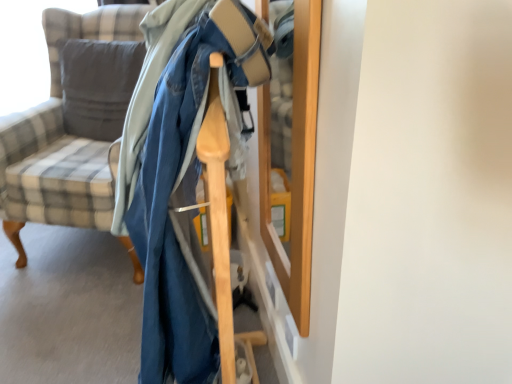
Question: Does plaid fabric chair at left have a larger size compared to soft gray cushion at left?

Choices:
 (A) no
 (B) yes

Answer: (B)

Question: Is plaid fabric chair at left closer to camera compared to soft gray cushion at left?

Choices:
 (A) yes
 (B) no

Answer: (A)

Question: Does plaid fabric chair at left have a lesser width compared to soft gray cushion at left?

Choices:
 (A) yes
 (B) no

Answer: (B)

Question: Is plaid fabric chair at left directly adjacent to soft gray cushion at left?

Choices:
 (A) yes
 (B) no

Answer: (A)

Question: Is plaid fabric chair at left oriented towards soft gray cushion at left?

Choices:
 (A) yes
 (B) no

Answer: (A)

Question: From the image's perspective, does plaid fabric chair at left appear lower than soft gray cushion at left?

Choices:
 (A) no
 (B) yes

Answer: (B)

Question: From a real-world perspective, is soft gray cushion at left on top of plaid fabric chair at left?

Choices:
 (A) no
 (B) yes

Answer: (B)

Question: Does soft gray cushion at left have a smaller size compared to plaid fabric chair at left?

Choices:
 (A) yes
 (B) no

Answer: (A)

Question: Considering the relative sizes of soft gray cushion at left and plaid fabric chair at left in the image provided, is soft gray cushion at left shorter than plaid fabric chair at left?

Choices:
 (A) yes
 (B) no

Answer: (A)

Question: Does soft gray cushion at left have a larger size compared to plaid fabric chair at left?

Choices:
 (A) no
 (B) yes

Answer: (A)

Question: From the image's perspective, is soft gray cushion at left on top of plaid fabric chair at left?

Choices:
 (A) yes
 (B) no

Answer: (A)

Question: Would you consider soft gray cushion at left to be distant from plaid fabric chair at left?

Choices:
 (A) yes
 (B) no

Answer: (B)

Question: Is soft gray cushion at left taller or shorter than plaid fabric chair at left?

Choices:
 (A) tall
 (B) short

Answer: (B)